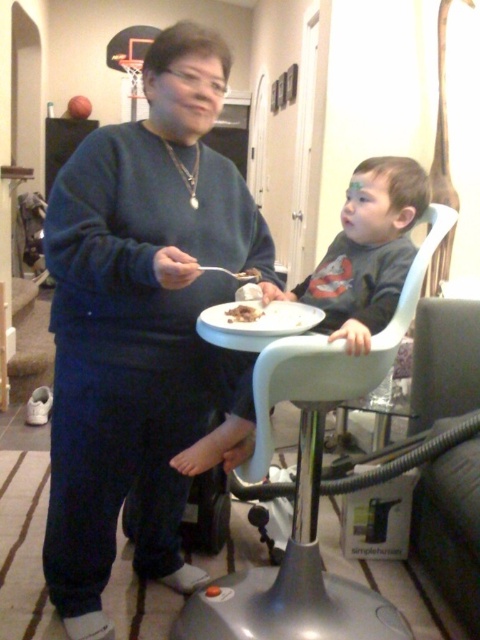
You are a parent trying to place a spoon on the table. The matte black high chair at center and the white matte plate at center are already on the table. Where should you place the spoon so it is to the right of the high chair but to the left of the plate?

Place the spoon between the matte black high chair at center and the white matte plate at center. Since the matte black high chair at center is to the left of the white matte plate at center, placing the spoon in between them would satisfy the requirement of being to the right of the high chair and to the left of the plate.

Please provide the 2D coordinates of the dark gray matte shirt at center in the image. The coordinates should be in the format of a point with two decimal places, such as point.

The dark gray matte shirt at center is located at point (367,252).